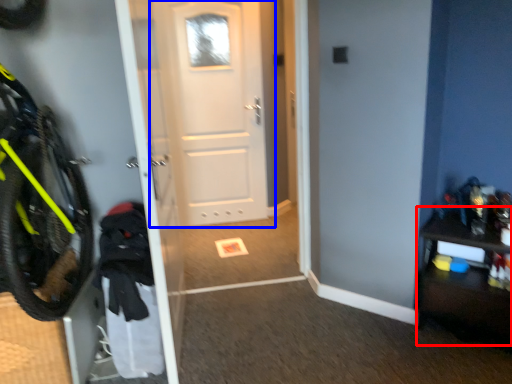
Question: Which object is further to the camera taking this photo, dresser (highlighted by a red box) or door (highlighted by a blue box)?

Choices:
 (A) dresser
 (B) door

Answer: (B)